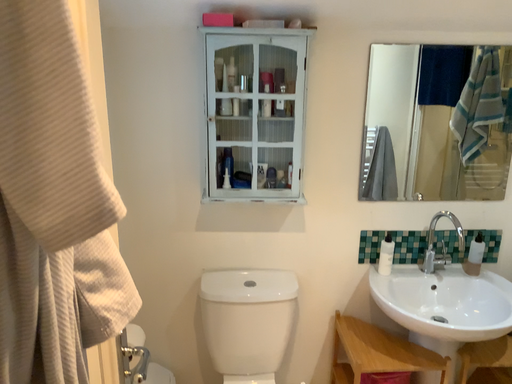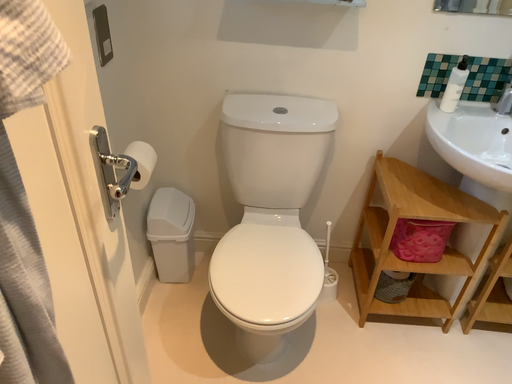
Question: Which way did the camera rotate in the video?

Choices:
 (A) rotated upward
 (B) rotated downward

Answer: (B)